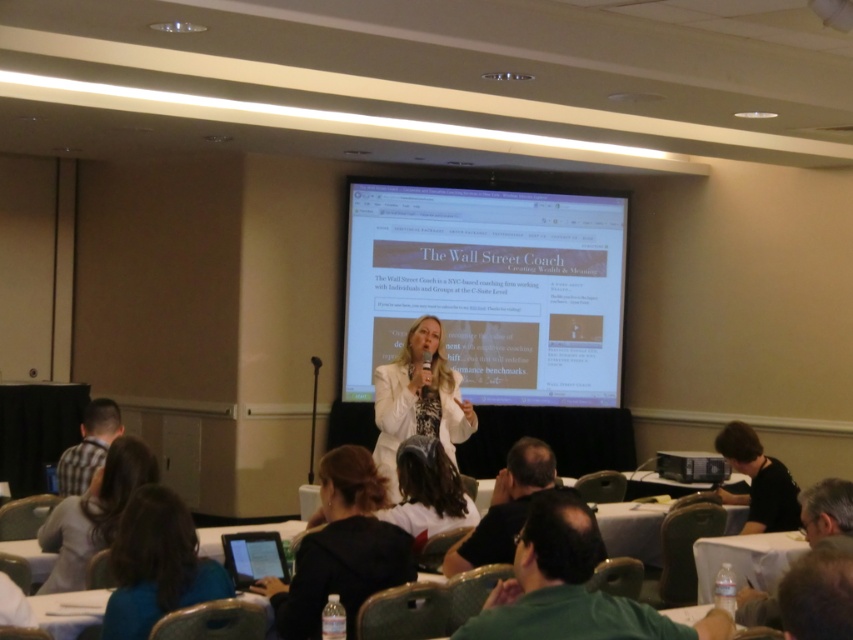
You are an attendee at the conference and want to take a photo of the presenter. The presenter is wearing a white fabric shirt at center and there is a black plastic projector at lower right. Which object is taller so that it might block the view of the projector?

The white fabric shirt at center has a greater height compared to the black plastic projector at lower right, so it might block the view of the black plastic projector at lower right.

You are an attendee at the conference and want to take a photo of the presenter. The presenter is wearing the white matte jacket at center and standing next to the black plastic projector at lower right. To avoid blocking others, you need to position yourself to the side of the presenter. Which side should you choose to ensure you are not in the presenter or the projector?

The white matte jacket at center is to the left of the black plastic projector at lower right, so positioning yourself to the right side of the presenter would keep you out of the presenter and the projector.